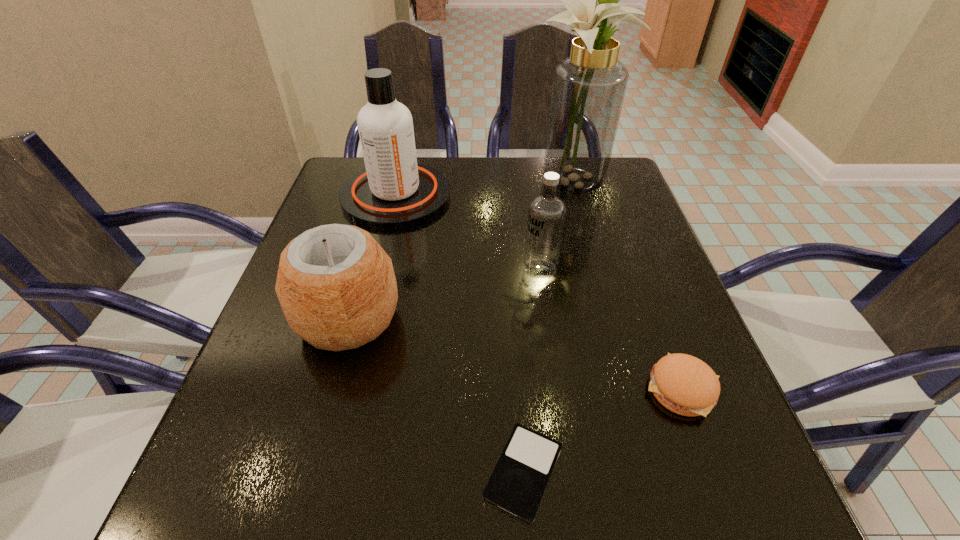
The width and height of the screenshot is (960, 540). Find the location of `free location that satisfies the following two spatial constraints: 1. on the front side of the iPod; 2. on the left side of the fifth shortest object`. free location that satisfies the following two spatial constraints: 1. on the front side of the iPod; 2. on the left side of the fifth shortest object is located at coordinates (329, 472).

Find the location of a particular element. This screenshot has width=960, height=540. vacant space that satisfies the following two spatial constraints: 1. on the back side of the cleansing agent; 2. on the right side of the tallest object is located at coordinates (399, 183).